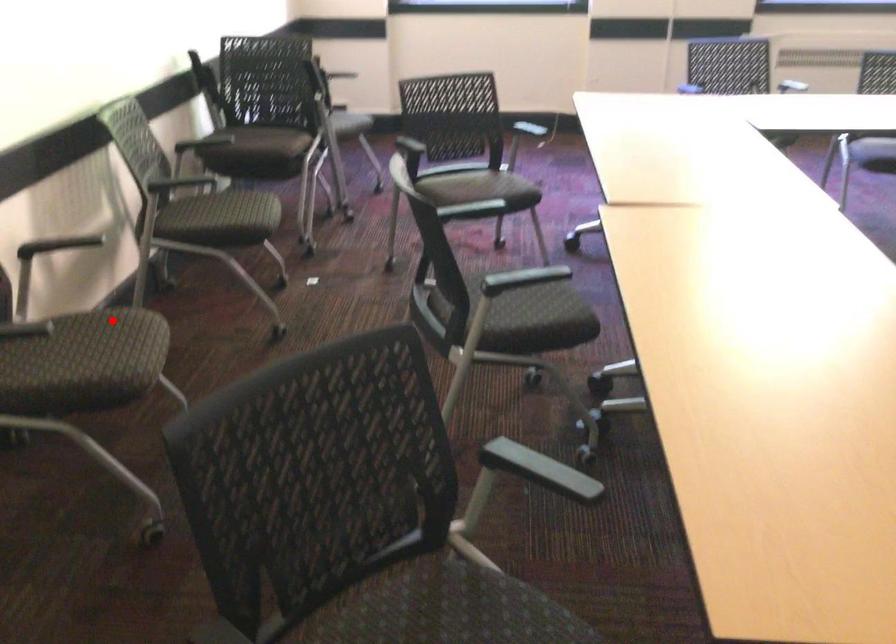
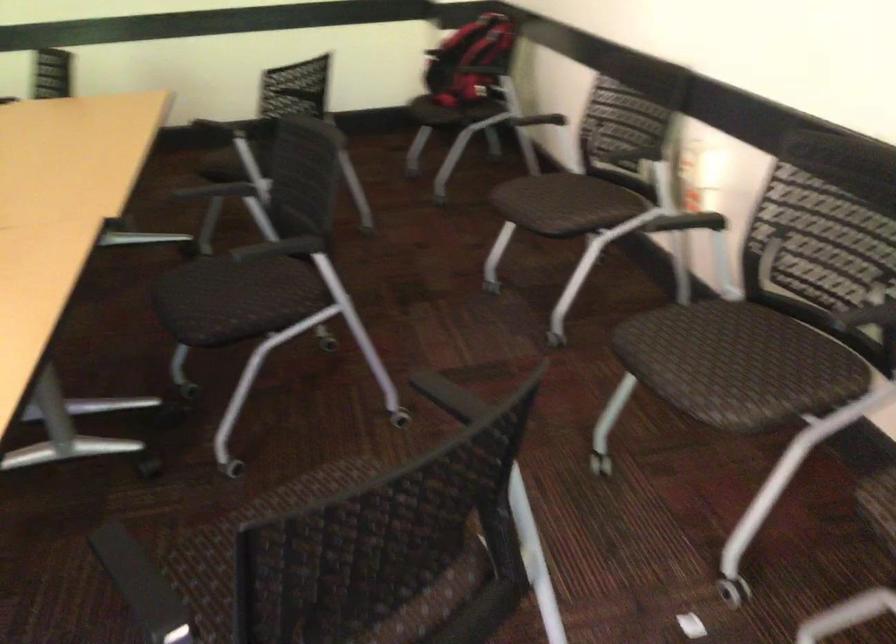
Find the pixel in the second image that matches the highlighted location in the first image.

(581, 207)